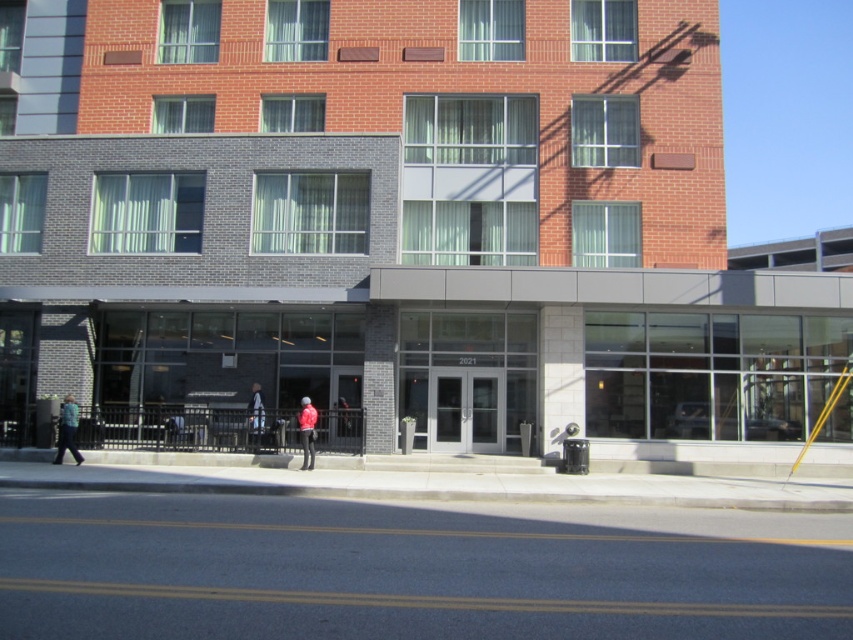
Question: Among these objects, which one is nearest to the camera?

Choices:
 (A) red matte jacket at center
 (B) green fabric jacket at lower left

Answer: (A)

Question: Does red matte jacket at center appear under light blue fabric jacket at center?

Choices:
 (A) no
 (B) yes

Answer: (A)

Question: Where is green fabric jacket at lower left located in relation to red matte jacket at center in the image?

Choices:
 (A) below
 (B) above

Answer: (B)

Question: Considering the real-world distances, which object is farthest from the green fabric jacket at lower left?

Choices:
 (A) light blue fabric jacket at center
 (B) red matte jacket at center

Answer: (B)

Question: Among these objects, which one is nearest to the camera?

Choices:
 (A) green fabric jacket at lower left
 (B) light blue fabric jacket at center

Answer: (A)

Question: Does green fabric jacket at lower left have a larger size compared to red matte jacket at center?

Choices:
 (A) yes
 (B) no

Answer: (A)